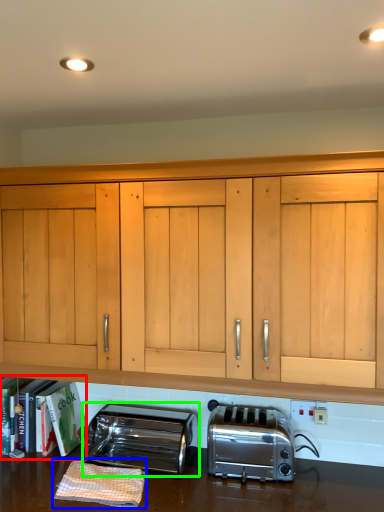
Question: Which object is positioned closest to bookshelf (highlighted by a red box)? Select from material (highlighted by a blue box) and toaster (highlighted by a green box).

Choices:
 (A) material
 (B) toaster

Answer: (B)